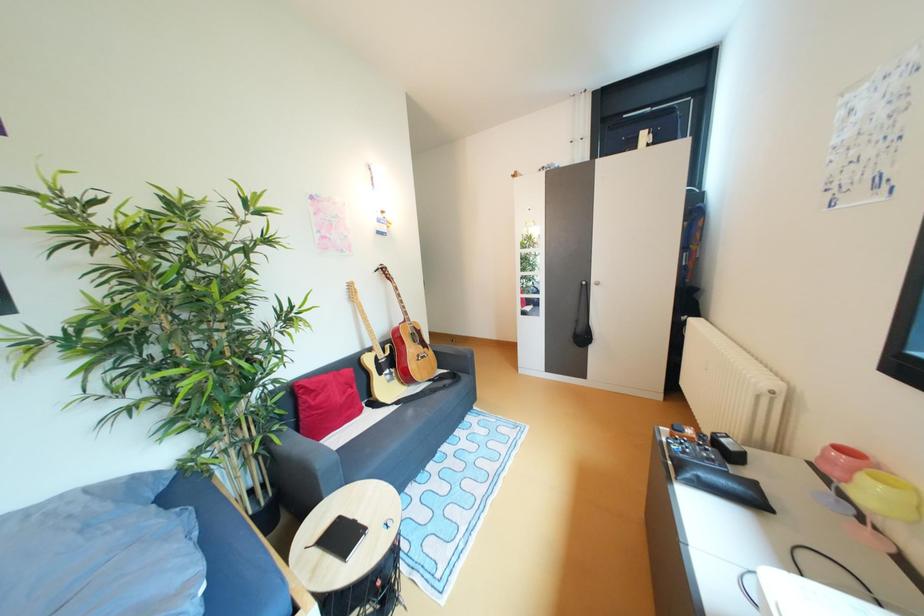
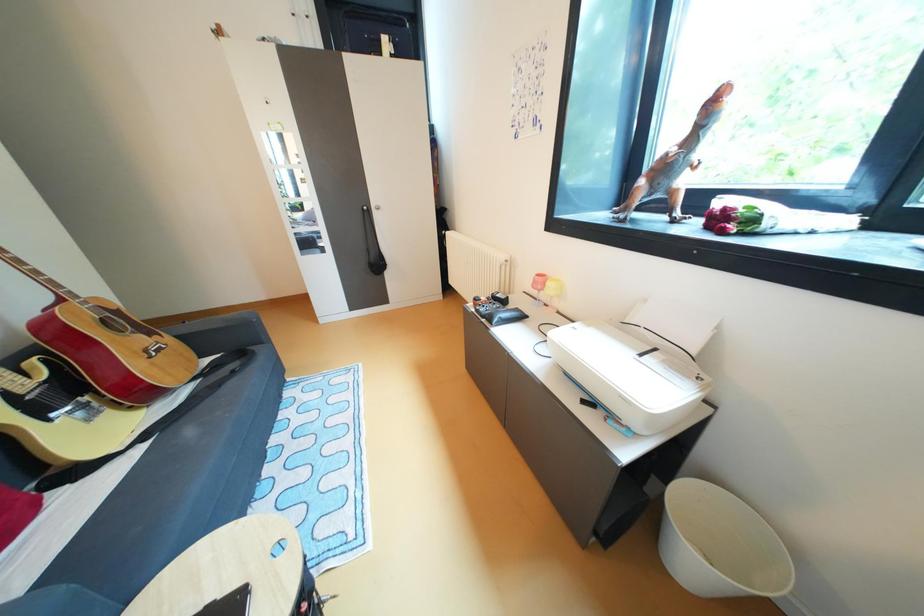
The first image is from the beginning of the video and the second image is from the end. How did the camera likely rotate when shooting the video?

The camera's rotation is toward right-down.